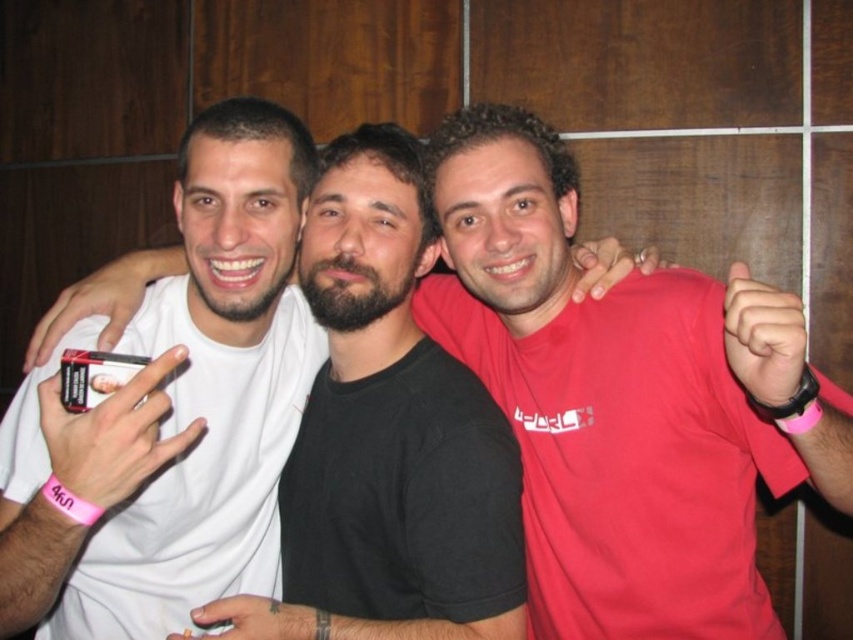
Who is positioned more to the left, pink rubber wristband at upper right or white matte t-shirt at center?

Positioned to the left is white matte t-shirt at center.

Is pink rubber wristband at upper right wider than white matte t-shirt at center?

Yes, pink rubber wristband at upper right is wider than white matte t-shirt at center.

The height and width of the screenshot is (640, 853). What do you see at coordinates (619, 397) in the screenshot? I see `pink rubber wristband at upper right` at bounding box center [619, 397].

This screenshot has height=640, width=853. I want to click on pink rubber wristband at upper right, so click(619, 397).